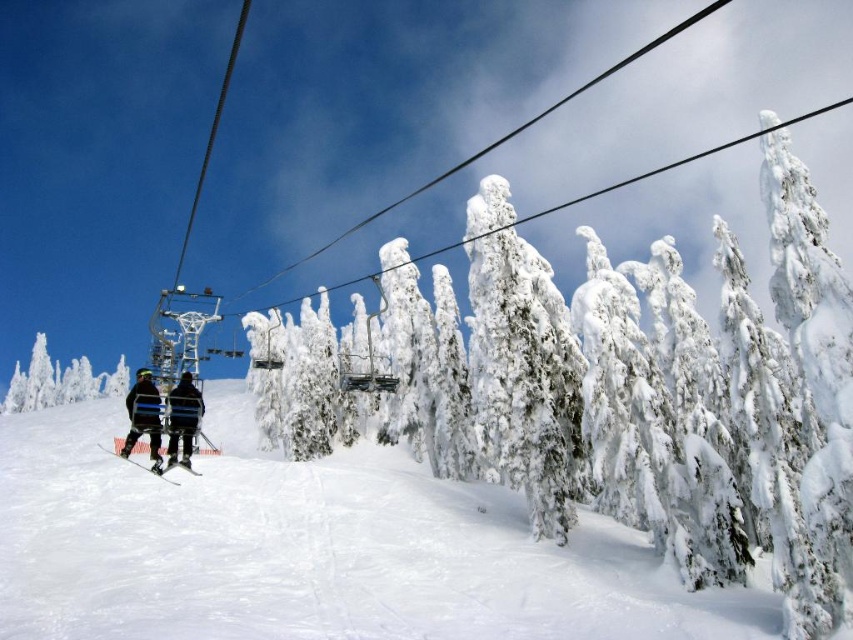
Question: Which point appears farthest from the camera in this image?

Choices:
 (A) (498, 227)
 (B) (86, 392)
 (C) (160, 458)
 (D) (126, 396)

Answer: (B)

Question: Is white frosty tree at lower left further to camera compared to dark blue fabric jacket at center?

Choices:
 (A) yes
 (B) no

Answer: (A)

Question: Among these points, which one is nearest to the camera?

Choices:
 (A) (198, 410)
 (B) (699, 154)
 (C) (271, 612)
 (D) (175, 460)

Answer: (A)

Question: Is white frosty tree at lower left wider than black ski suit at center?

Choices:
 (A) yes
 (B) no

Answer: (A)

Question: Can you confirm if dark blue fabric jacket at center is thinner than black matte skis at lower left?

Choices:
 (A) yes
 (B) no

Answer: (A)

Question: Which point is farther from the camera taking this photo?

Choices:
 (A) (169, 440)
 (B) (143, 467)
 (C) (57, 358)

Answer: (C)